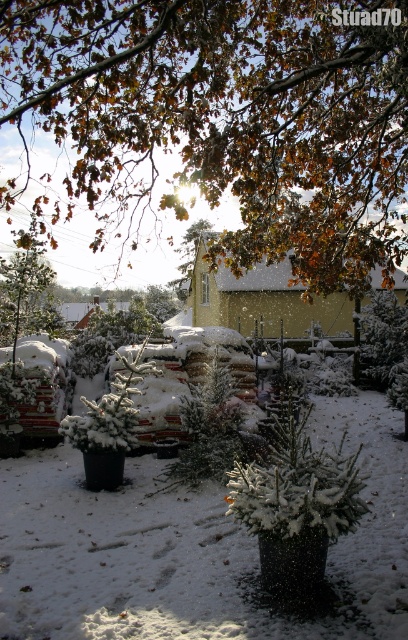
Based on the photo, you are standing in the winter garden and want to locate the brown leafy tree at upper center. According to the coordinates provided, where should you look?

You should look at point (226, 120) to find the brown leafy tree at upper center.

You are planning to place a new garden statue that requires a 1.2 meter height clearance. Given the green textured evergreen tree at center and the green matte tree at center, which one allows enough space for the statue?

The green matte tree at center is taller than the green textured evergreen tree at center, so placing the statue near the green textured evergreen tree at center would provide sufficient height clearance of 1.2 meters.